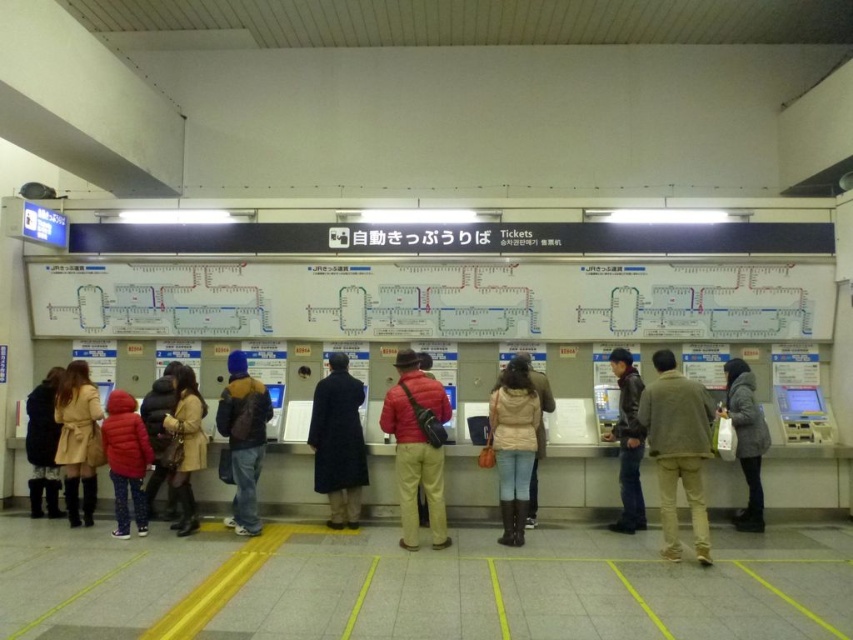
Between red puffy coat at lower left and velvet black coat at lower left, which one has less height?

With less height is red puffy coat at lower left.

Who is positioned more to the left, red puffy coat at lower left or velvet black coat at lower left?

From the viewer's perspective, velvet black coat at lower left appears more on the left side.

Which is in front, point (140, 422) or point (48, 440)?

Point (140, 422)

Locate an element on the screen. The image size is (853, 640). red puffy coat at lower left is located at coordinates (125, 460).

Is dark blue coat at center to the right of dark gray wool coat at right from the viewer's perspective?

No, dark blue coat at center is not to the right of dark gray wool coat at right.

Describe the element at coordinates (338, 442) in the screenshot. I see `dark blue coat at center` at that location.

Is point (329, 486) less distant than point (764, 422)?

Yes.

You are a GUI agent. You are given a task and a screenshot of the screen. Output one action in this format:
    pyautogui.click(x=<x>, y=<y>)
    Task: Click on the dark blue coat at center
    The height and width of the screenshot is (640, 853).
    Given the screenshot: What is the action you would take?
    pyautogui.click(x=338, y=442)

Does beige leather coat at lower left have a greater width compared to red puffy coat at lower left?

No.

What do you see at coordinates (77, 440) in the screenshot?
I see `beige leather coat at lower left` at bounding box center [77, 440].

The height and width of the screenshot is (640, 853). Identify the location of beige leather coat at lower left. (77, 440).